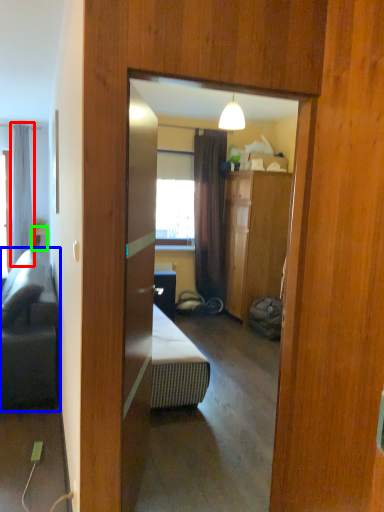
Question: Which is nearer to the curtain (highlighted by a red box)? studio couch (highlighted by a blue box) or table (highlighted by a green box).

Choices:
 (A) studio couch
 (B) table

Answer: (B)